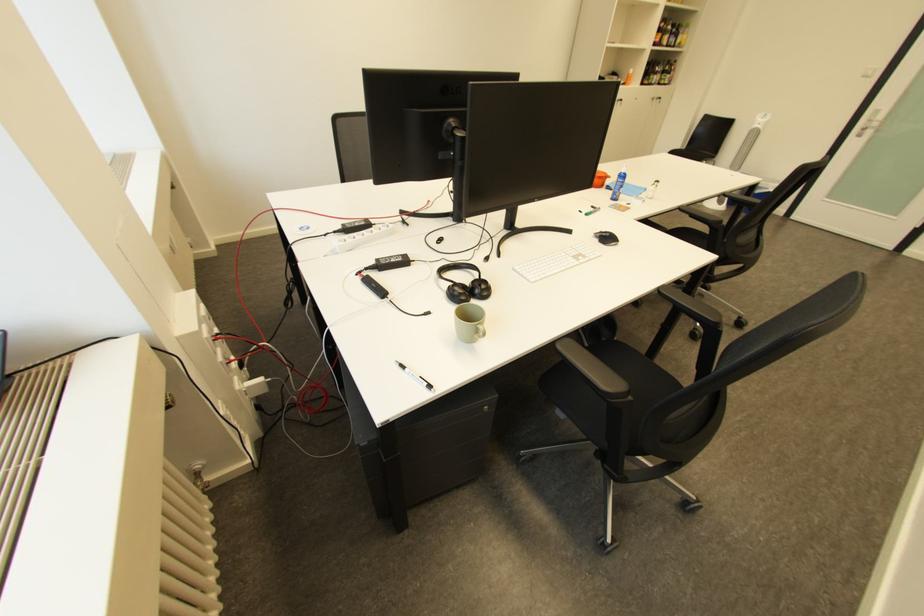
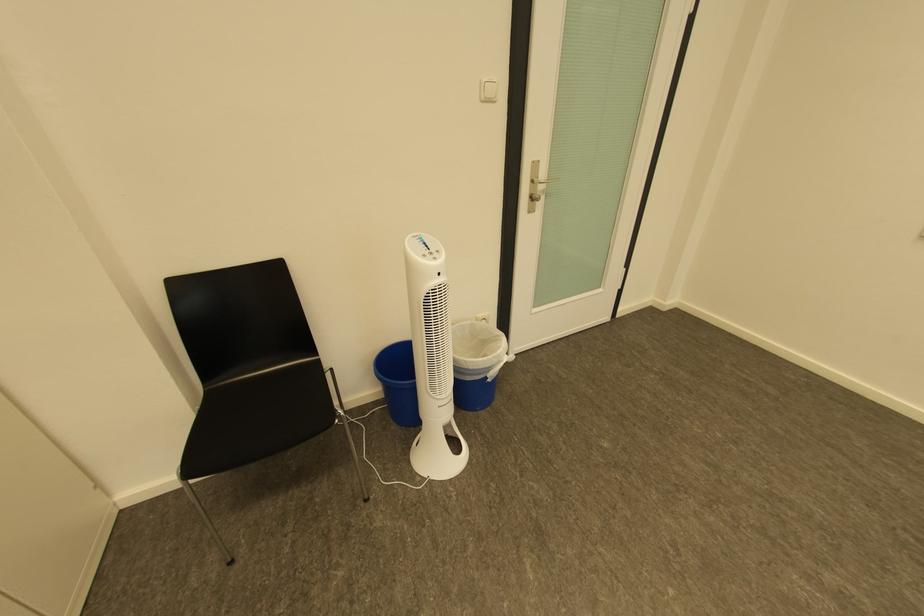
In the second image, find the point that corresponds to pixel 770 188 in the first image.

(499, 370)